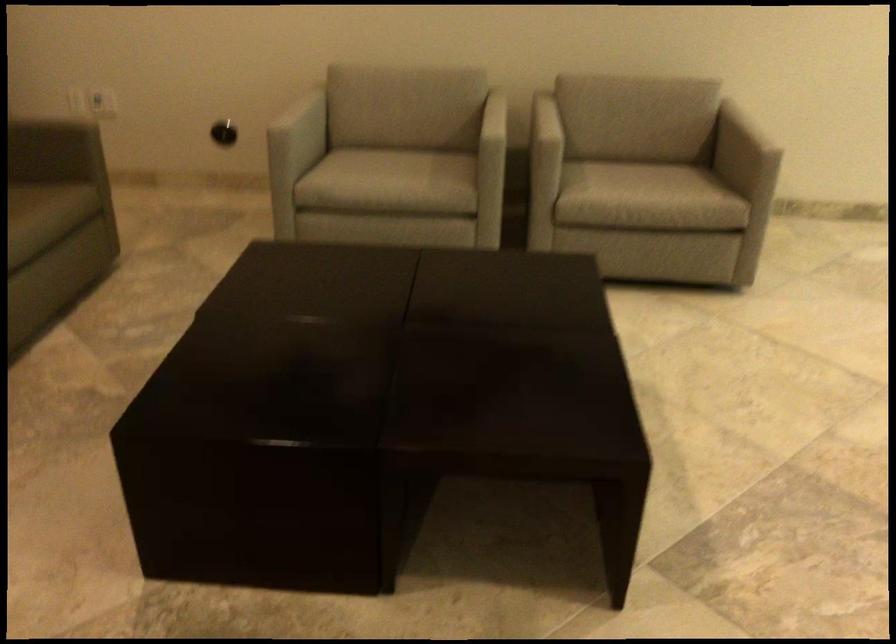
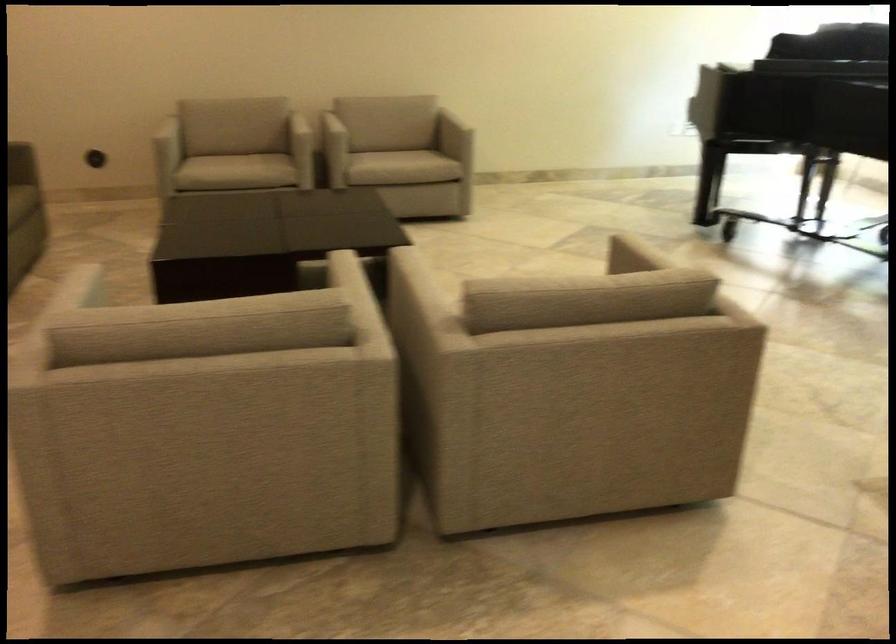
In the second image, find the point that corresponds to [545,140] in the first image.

(337, 128)